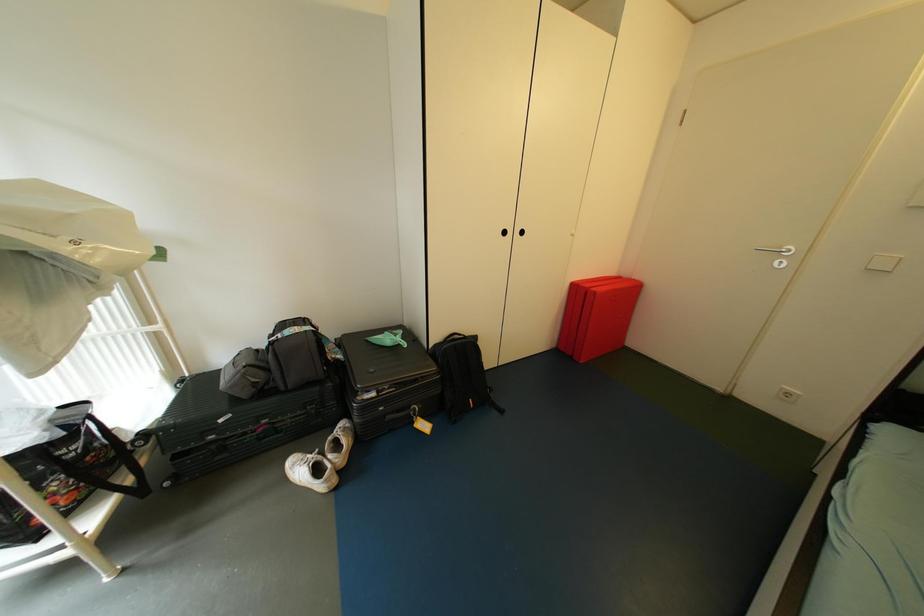
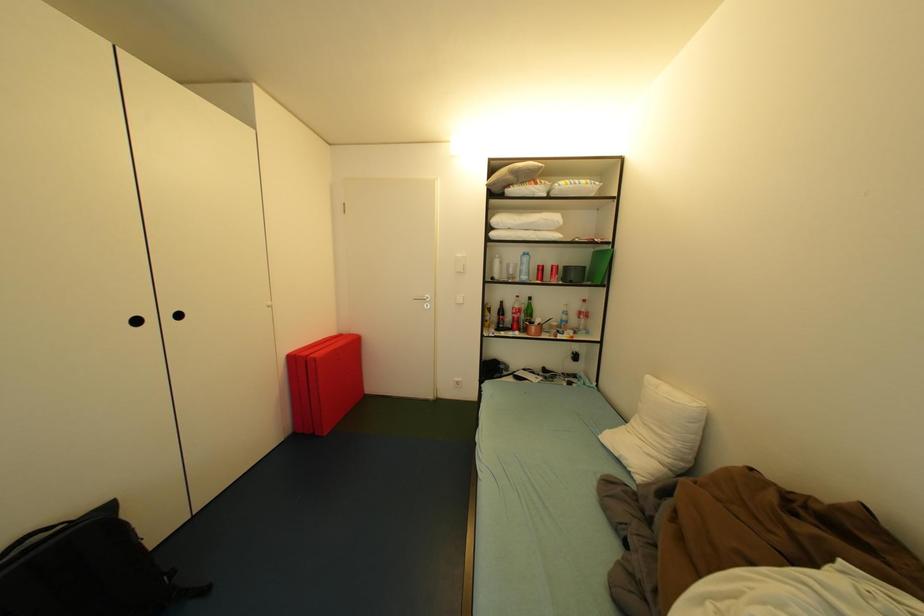
Question: The first image is from the beginning of the video and the second image is from the end. How did the camera likely rotate when shooting the video?

Choices:
 (A) Left
 (B) Right
 (C) Up
 (D) Down

Answer: (B)